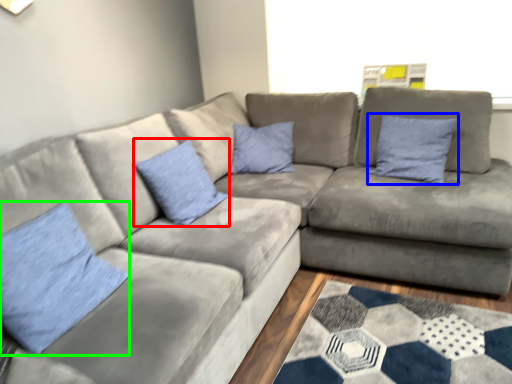
Question: Based on their relative distances, which object is nearer to pillow (highlighted by a red box)? Choose from pillow (highlighted by a blue box) and pillow (highlighted by a green box).

Choices:
 (A) pillow
 (B) pillow

Answer: (B)